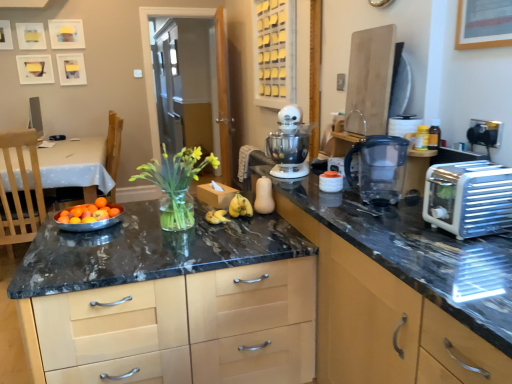
Where is `vacant space to the right of orange matte/orange at center`? The height and width of the screenshot is (384, 512). vacant space to the right of orange matte/orange at center is located at coordinates pos(138,210).